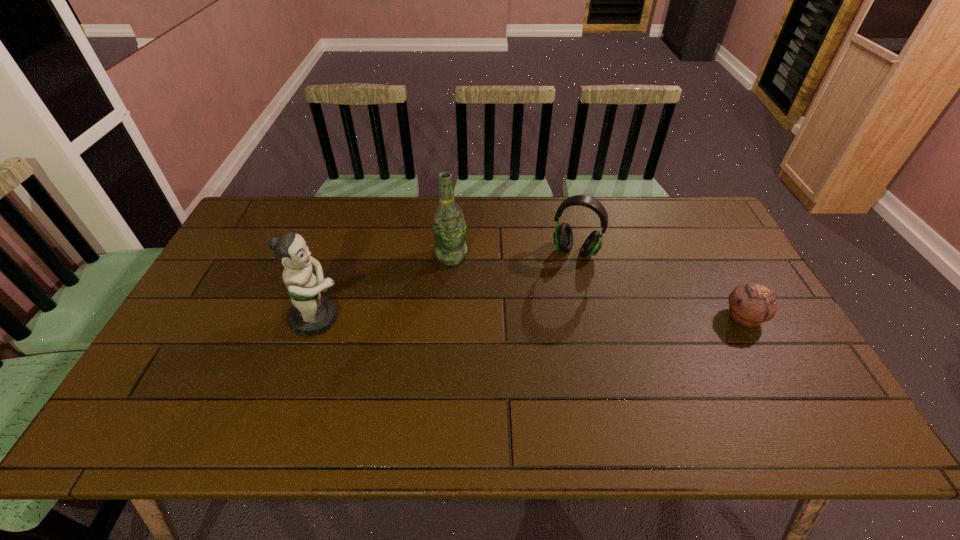
Find the location of a particular element. The width and height of the screenshot is (960, 540). vacant region at the near right corner of the desktop is located at coordinates (746, 370).

I want to click on empty location between the shortest object and the headset, so click(x=660, y=285).

Locate an element on the screen. The image size is (960, 540). vacant point located between the beer bottle and the leftmost object is located at coordinates (384, 287).

Find the location of a particular element. The image size is (960, 540). empty space that is in between the leftmost object and the rightmost object is located at coordinates (531, 318).

You are a GUI agent. You are given a task and a screenshot of the screen. Output one action in this format:
    pyautogui.click(x=<x>, y=<y>)
    Task: Click on the unoccupied position between the second object from left to right and the headset
    The image size is (960, 540).
    Given the screenshot: What is the action you would take?
    pyautogui.click(x=513, y=254)

This screenshot has width=960, height=540. I want to click on free spot between the figurine and the rightmost object, so click(x=531, y=318).

Image resolution: width=960 pixels, height=540 pixels. Find the location of `vacant region between the leftmost object and the third tallest object`. vacant region between the leftmost object and the third tallest object is located at coordinates (446, 285).

Find the location of a particular element. Image resolution: width=960 pixels, height=540 pixels. vacant area that lies between the third object from left to right and the muffin is located at coordinates (660, 285).

You are a GUI agent. You are given a task and a screenshot of the screen. Output one action in this format:
    pyautogui.click(x=<x>, y=<y>)
    Task: Click on the empty location between the leftmost object and the third object from left to right
    The height and width of the screenshot is (540, 960).
    Given the screenshot: What is the action you would take?
    pyautogui.click(x=446, y=285)

Where is `free space that is in between the figurine and the headset`? This screenshot has height=540, width=960. free space that is in between the figurine and the headset is located at coordinates (446, 285).